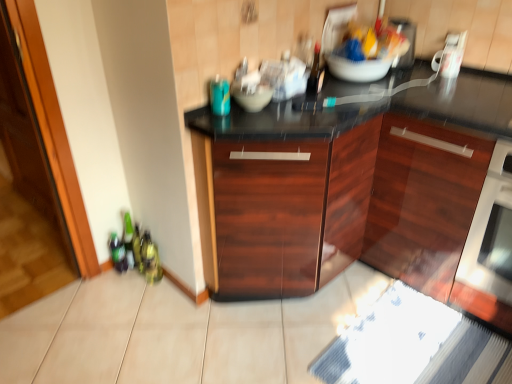
I want to click on free space to the left of mahogany wood cabinet at center, the second cabinetry when ordered from right to left, so click(164, 325).